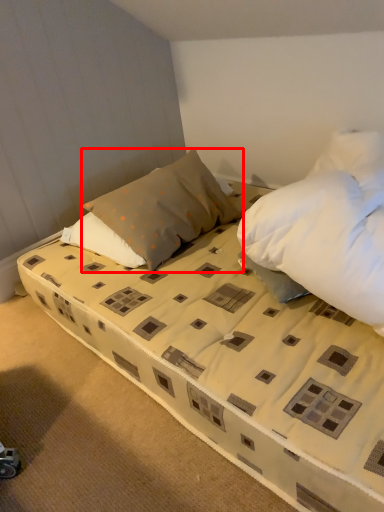
Question: From the image's perspective, where is pillow (annotated by the red box) located in relation to bed in the image?

Choices:
 (A) below
 (B) above

Answer: (B)